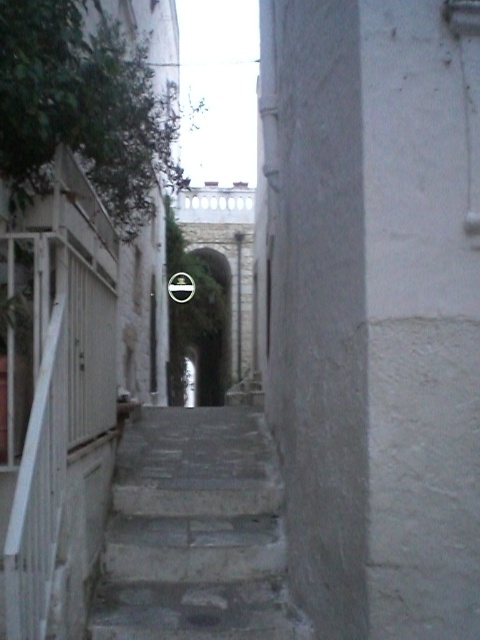
Question: Which object appears farthest from the camera in this image?

Choices:
 (A) white matte rail at left
 (B) concrete stairs at center

Answer: (B)

Question: Which point is closer to the camera?

Choices:
 (A) (192, 572)
 (B) (23, 531)

Answer: (B)

Question: Does concrete stairs at center lie behind white matte rail at left?

Choices:
 (A) yes
 (B) no

Answer: (A)

Question: Considering the relative positions of concrete stairs at center and white matte rail at left in the image provided, where is concrete stairs at center located with respect to white matte rail at left?

Choices:
 (A) right
 (B) left

Answer: (A)

Question: Which of the following is the farthest from the observer?

Choices:
 (A) (177, 605)
 (B) (8, 552)

Answer: (A)

Question: Can you confirm if concrete stairs at center is positioned above white matte rail at left?

Choices:
 (A) no
 (B) yes

Answer: (A)